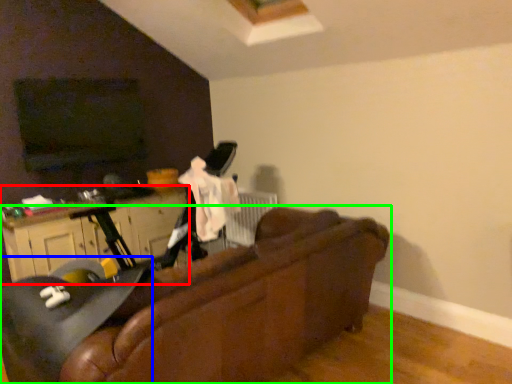
Question: Which object is positioned farthest from dresser (highlighted by a red box)? Select from swivel chair (highlighted by a blue box) and studio couch (highlighted by a green box).

Choices:
 (A) swivel chair
 (B) studio couch

Answer: (B)